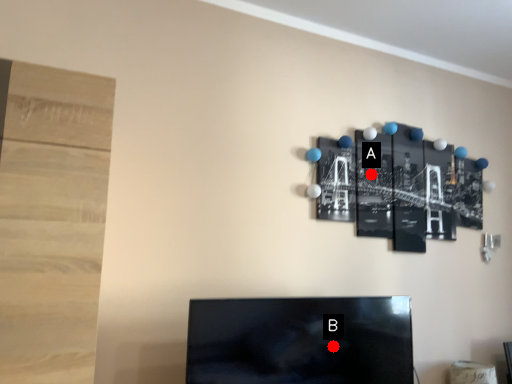
Question: Two points are circled on the image, labeled by A and B beside each circle. Which of the following is the farthest from the observer?

Choices:
 (A) A is further
 (B) B is further

Answer: (A)